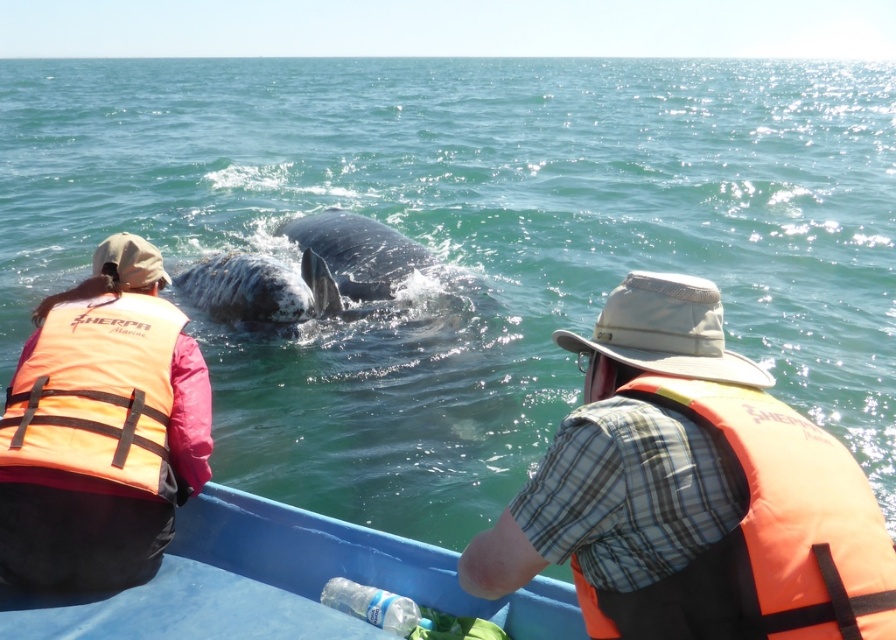
You are a marine biologist on a boat and need to retrieve the clear plastic bottle at lower center. You are currently near the orange fabric life jacket at right. Given that your reach is 4 feet, can you grab the bottle without moving from your position?

The distance between the orange fabric life jacket at right and the clear plastic bottle at lower center is 4.01 feet. Since your reach is 4 feet, you cannot grab the bottle without moving because the distance is slightly more than your reach.

You are standing on the boat and want to measure the distance to the whale. There is a point marked at coordinates point [790,556] which is 6.28 feet away from you. Can you estimate how far the whale is from your current position?

The whale is located at point [790,556], which is 6.28 feet away from you. Therefore, the whale is approximately 6.28 feet away from your current position on the boat.